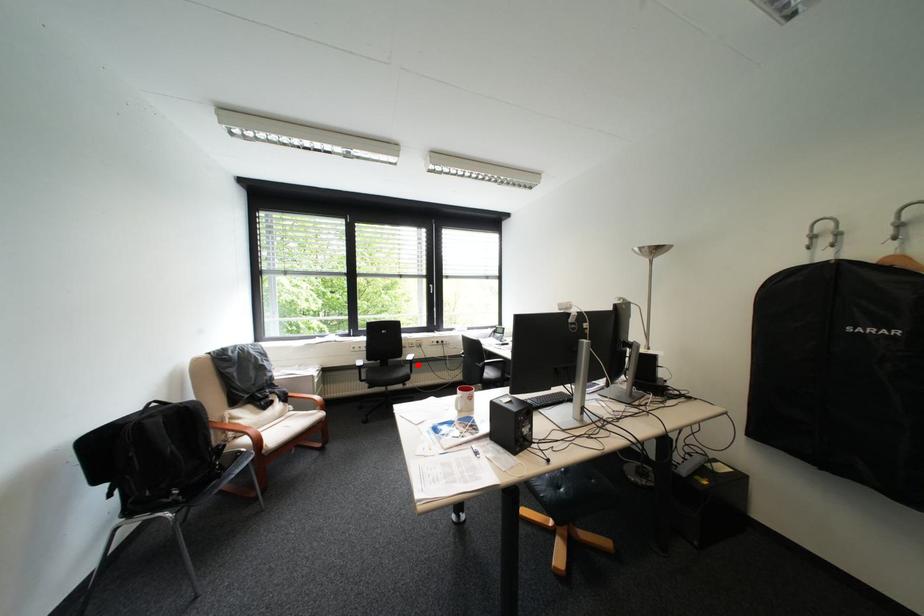
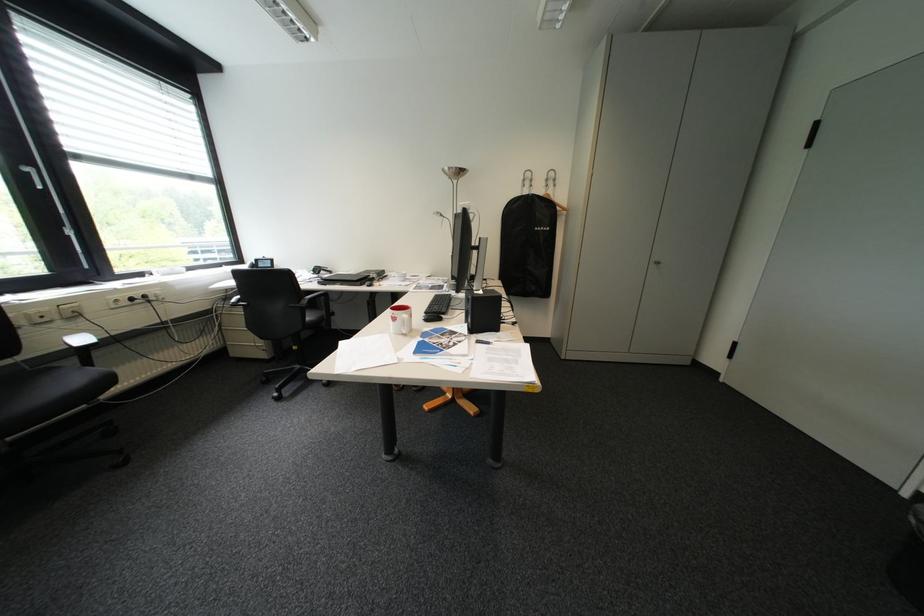
Where in the second image is the point corresponding to the highlighted location from the first image?

(59, 367)